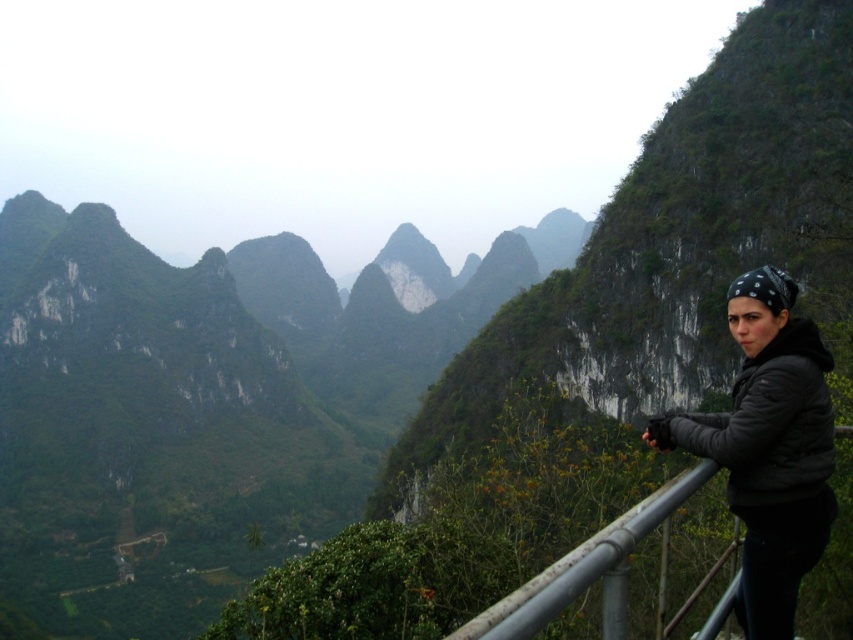
You are a photographer trying to capture a wide shot of the mountain landscape. You notice the black matte jacket at right and the rusty metal railing at lower right in your frame. Which object takes up more space in the photo?

The rusty metal railing at lower right takes up more space in the photo than the black matte jacket at right because the black matte jacket at right occupies less space than the rusty metal railing at lower right.

You are a photographer planning to take a photo of the black matte jacket at right from a viewpoint located at point 0.500, 0.500. Based on their positions, will the jacket be in the foreground or background of your photo?

The black matte jacket at right is positioned at point (769, 448), which is closer to the camera than the viewpoint at (426, 320). Therefore, the jacket will be in the foreground of the photo.